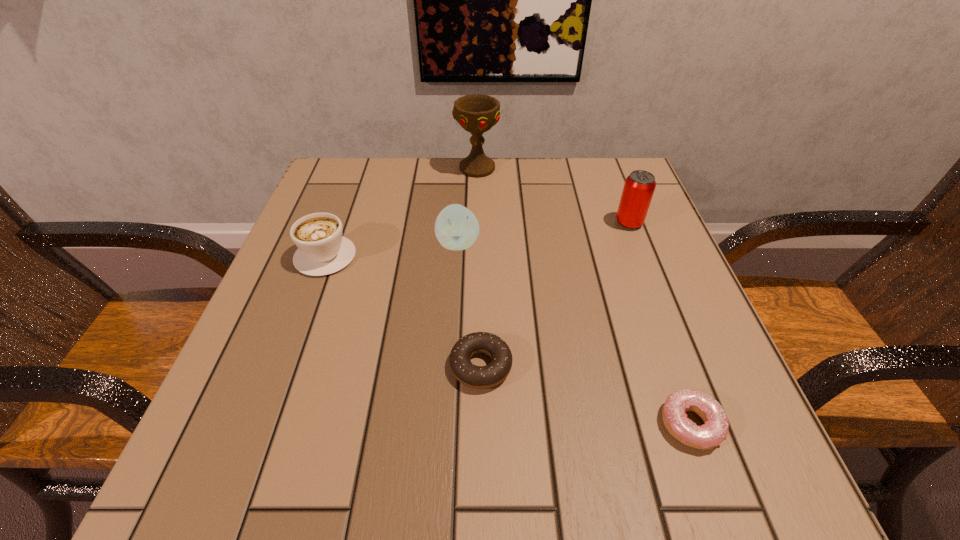
Identify the location of free space at the far left corner of the desktop. The height and width of the screenshot is (540, 960). (366, 174).

I want to click on free space at the far right corner, so click(618, 177).

Locate an element on the screen. This screenshot has height=540, width=960. free spot between the apple and the tallest object is located at coordinates (468, 206).

Locate an element on the screen. free spot between the farthest object and the right doughnut is located at coordinates (584, 296).

At what (x,y) coordinates should I click in order to perform the action: click on vacant space in between the fourth tallest object and the left doughnut. Please return your answer as a coordinate pair (x, y). This screenshot has width=960, height=540. Looking at the image, I should click on (x=403, y=311).

Find the location of a particular element. The width and height of the screenshot is (960, 540). vacant space in between the farther doughnut and the apple is located at coordinates (469, 305).

Locate an element on the screen. This screenshot has width=960, height=540. free space between the nearest object and the fifth shortest object is located at coordinates (660, 323).

The image size is (960, 540). Identify the location of vacant point located between the fifth shortest object and the third shortest object. (477, 239).

Find the location of a particular element. The width and height of the screenshot is (960, 540). free space between the leftmost object and the apple is located at coordinates (392, 249).

Where is `free space that is in between the apple and the can`? The width and height of the screenshot is (960, 540). free space that is in between the apple and the can is located at coordinates (543, 233).